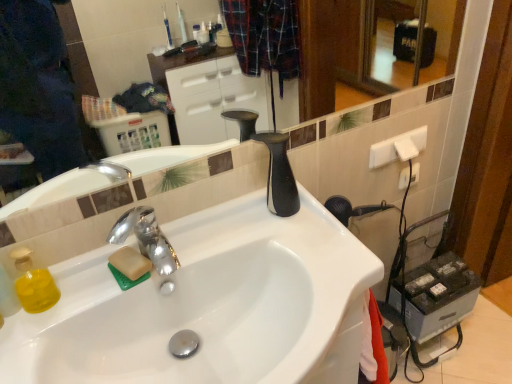
Question: Is glossy ceramic mirror at upper center in front of or behind white plastic electric outlet at upper right in the image?

Choices:
 (A) behind
 (B) front

Answer: (B)

Question: Is glossy ceramic mirror at upper center taller or shorter than white plastic electric outlet at upper right?

Choices:
 (A) tall
 (B) short

Answer: (A)

Question: Which object is the farthest from the glossy ceramic mirror at upper center?

Choices:
 (A) chrome metallic faucet at center
 (B) white plastic electric outlet at upper right
 (C) white glossy sink at center

Answer: (A)

Question: Which of these objects is positioned closest to the white plastic electric outlet at upper right?

Choices:
 (A) glossy ceramic mirror at upper center
 (B) white glossy sink at center
 (C) chrome metallic faucet at center

Answer: (B)